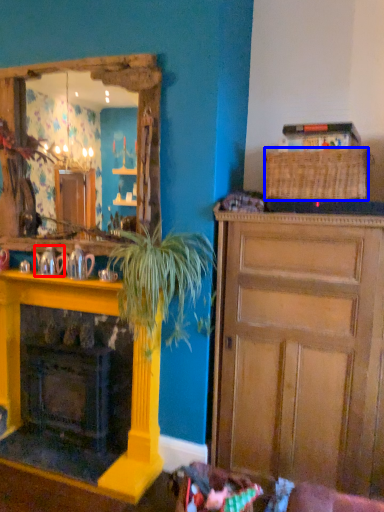
Question: Which object is closer to the camera taking this photo, teapot (highlighted by a red box) or picnic basket (highlighted by a blue box)?

Choices:
 (A) teapot
 (B) picnic basket

Answer: (B)